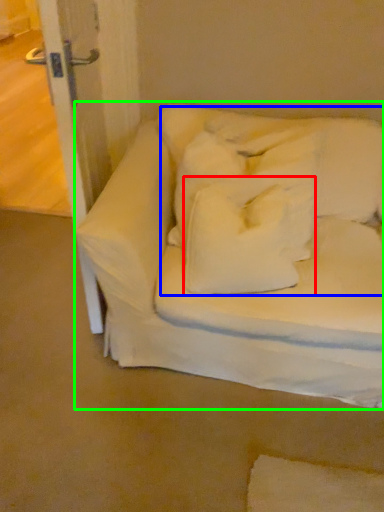
Question: Considering the real-world distances, which object is farthest from pillow (highlighted by a red box)? bedding (highlighted by a blue box) or furniture (highlighted by a green box)?

Choices:
 (A) bedding
 (B) furniture

Answer: (B)